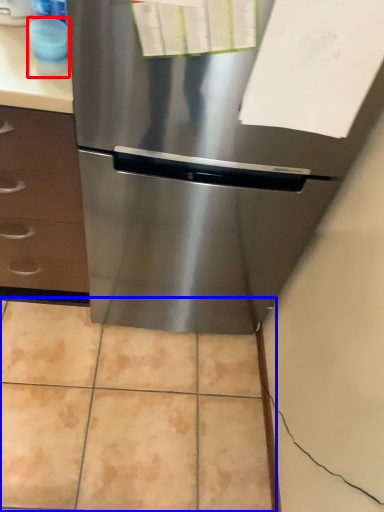
Question: Which point is further to the camera, appliance (highlighted by a red box) or ceramic tile (highlighted by a blue box)?

Choices:
 (A) appliance
 (B) ceramic tile

Answer: (B)